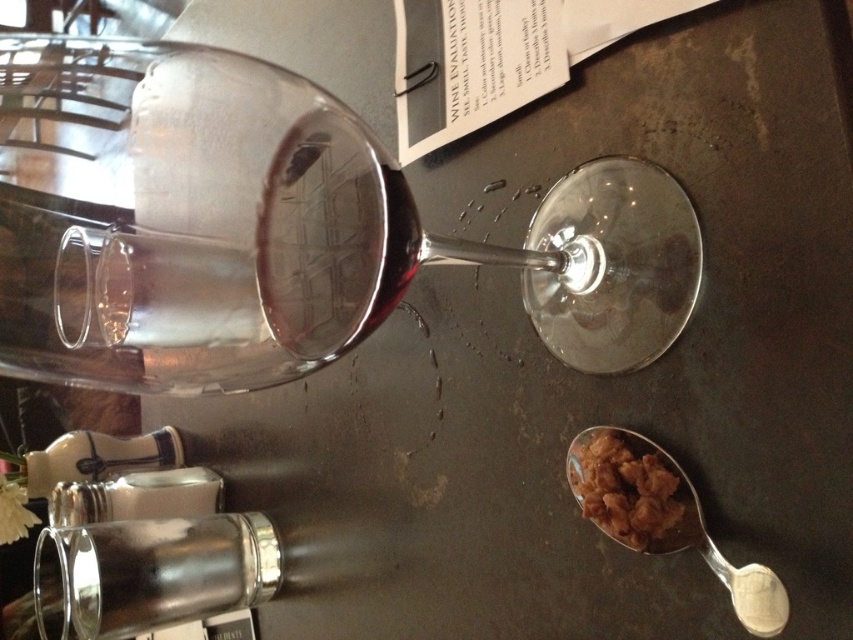
Does silver metallic bottle at lower left have a lesser width compared to brown crumbly snack at lower right?

No, silver metallic bottle at lower left is not thinner than brown crumbly snack at lower right.

Is silver metallic bottle at lower left bigger than brown crumbly snack at lower right?

Yes, silver metallic bottle at lower left is bigger than brown crumbly snack at lower right.

Which is in front, point (236, 538) or point (579, 458)?

Point (579, 458) is in front.

Find the location of `silver metallic bottle at lower left`. silver metallic bottle at lower left is located at coordinates (152, 573).

Which is below, brown crumbly snack at lower right or silver metallic spoon at lower right?

Positioned lower is silver metallic spoon at lower right.

Can you confirm if brown crumbly snack at lower right is wider than silver metallic spoon at lower right?

No, brown crumbly snack at lower right is not wider than silver metallic spoon at lower right.

The width and height of the screenshot is (853, 640). Identify the location of brown crumbly snack at lower right. (625, 488).

Can you confirm if transparent glass at upper center is bigger than silver metallic spoon at lower right?

Yes.

The image size is (853, 640). Describe the element at coordinates (276, 228) in the screenshot. I see `transparent glass at upper center` at that location.

At what (x,y) coordinates should I click in order to perform the action: click on transparent glass at upper center. Please return your answer as a coordinate pair (x, y). Image resolution: width=853 pixels, height=640 pixels. Looking at the image, I should click on (276, 228).